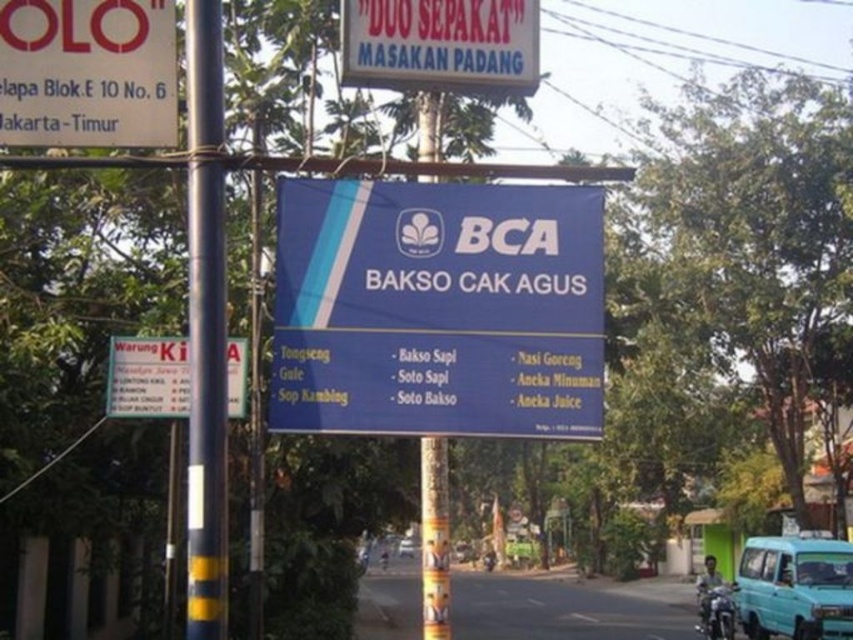
You are a delivery driver who needs to deliver a package to the BCA BAKSO CAK AGUS restaurant. The GPS shows that the entrance is near the white plastic sign at upper left. Based on the scene description, can you confirm if the entrance is on the left side of the main signboard?

The white plastic sign at upper left is located at point (86,72), which is to the left of the main signboard. Therefore, the entrance is on the left side of the main signboard.

You are a delivery driver who needs to park your teal matte van at lower right near the white plastic sign at upper left. Can you park your van close enough to the sign so that it doesn

The white plastic sign at upper left is shorter than the teal matte van at lower right, so the van can park close to the sign without blocking the view of the sign since it is taller than the sign.